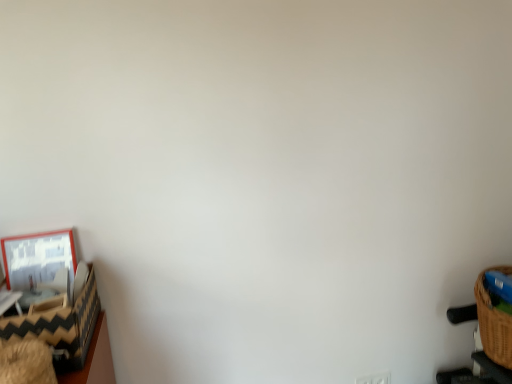
What do you see at coordinates (375, 378) in the screenshot? I see `white plastic electric outlet at lower right` at bounding box center [375, 378].

The image size is (512, 384). Identify the location of black and white zigzag-patterned basket at left. (61, 327).

Who is shorter, black and white zigzag-patterned basket at left or white plastic electric outlet at lower right?

With less height is white plastic electric outlet at lower right.

Is black and white zigzag-patterned basket at left wider than white plastic electric outlet at lower right?

Indeed, black and white zigzag-patterned basket at left has a greater width compared to white plastic electric outlet at lower right.

Is black and white zigzag-patterned basket at left spatially inside white plastic electric outlet at lower right, or outside of it?

black and white zigzag-patterned basket at left exists outside the volume of white plastic electric outlet at lower right.

Is matte wooden picture frame at left a part of black and white zigzag-patterned basket at left?

Definitely not — matte wooden picture frame at left is not inside black and white zigzag-patterned basket at left.

From the image's perspective, between black and white zigzag-patterned basket at left and matte wooden picture frame at left, who is located below?

black and white zigzag-patterned basket at left, from the image's perspective.

Based on the photo, could you tell me if black and white zigzag-patterned basket at left is turned towards matte wooden picture frame at left?

No, black and white zigzag-patterned basket at left is not aimed at matte wooden picture frame at left.

What's the angular difference between white plastic electric outlet at lower right and matte wooden picture frame at left's facing directions?

The angle between the facing direction of white plastic electric outlet at lower right and the facing direction of matte wooden picture frame at left is 1.95 degrees.

Is white plastic electric outlet at lower right at the right side of matte wooden picture frame at left?

Yes, white plastic electric outlet at lower right is to the right of matte wooden picture frame at left.

Which of these two, white plastic electric outlet at lower right or matte wooden picture frame at left, is thinner?

With smaller width is white plastic electric outlet at lower right.

Identify the location of picture frame to the left of white plastic electric outlet at lower right. (x=39, y=260).

Could black and white zigzag-patterned basket at left be considered to be inside matte wooden picture frame at left?

Definitely not — black and white zigzag-patterned basket at left is not inside matte wooden picture frame at left.

Can you confirm if matte wooden picture frame at left is positioned to the left of black and white zigzag-patterned basket at left?

Indeed, matte wooden picture frame at left is positioned on the left side of black and white zigzag-patterned basket at left.

From a real-world perspective, does matte wooden picture frame at left stand above black and white zigzag-patterned basket at left?

Indeed, from a real-world perspective, matte wooden picture frame at left stands above black and white zigzag-patterned basket at left.

Considering the sizes of objects matte wooden picture frame at left and black and white zigzag-patterned basket at left in the image provided, who is bigger, matte wooden picture frame at left or black and white zigzag-patterned basket at left?

With larger size is black and white zigzag-patterned basket at left.

From a real-world perspective, is matte wooden picture frame at left positioned under white plastic electric outlet at lower right based on gravity?

No, from a real-world perspective, matte wooden picture frame at left is not below white plastic electric outlet at lower right.

Is matte wooden picture frame at left thinner than white plastic electric outlet at lower right?

In fact, matte wooden picture frame at left might be wider than white plastic electric outlet at lower right.

From the image's perspective, is matte wooden picture frame at left below white plastic electric outlet at lower right?

No.

What are the coordinates of `picture frame above the white plastic electric outlet at lower right (from a real-world perspective)` in the screenshot? It's located at (39, 260).

Is white plastic electric outlet at lower right oriented towards black and white zigzag-patterned basket at left?

No, white plastic electric outlet at lower right is not facing towards black and white zigzag-patterned basket at left.

Considering the relative positions of white plastic electric outlet at lower right and black and white zigzag-patterned basket at left in the image provided, is white plastic electric outlet at lower right to the left of black and white zigzag-patterned basket at left from the viewer's perspective?

In fact, white plastic electric outlet at lower right is to the right of black and white zigzag-patterned basket at left.

How much distance is there between white plastic electric outlet at lower right and black and white zigzag-patterned basket at left?

white plastic electric outlet at lower right and black and white zigzag-patterned basket at left are 4.02 feet apart from each other.

You are a GUI agent. You are given a task and a screenshot of the screen. Output one action in this format:
    pyautogui.click(x=<x>, y=<y>)
    Task: Click on the basket located on the left of white plastic electric outlet at lower right
    
    Given the screenshot: What is the action you would take?
    pyautogui.click(x=61, y=327)

At what (x,y) coordinates should I click in order to perform the action: click on picture frame above the black and white zigzag-patterned basket at left (from the image's perspective). Please return your answer as a coordinate pair (x, y). Image resolution: width=512 pixels, height=384 pixels. Looking at the image, I should click on (39, 260).

Which object lies nearer to the anchor point black and white zigzag-patterned basket at left, white plastic electric outlet at lower right or matte wooden picture frame at left?

matte wooden picture frame at left is positioned closer to the anchor black and white zigzag-patterned basket at left.

Based on their spatial positions, is matte wooden picture frame at left or white plastic electric outlet at lower right closer to black and white zigzag-patterned basket at left?

Among the two, matte wooden picture frame at left is located nearer to black and white zigzag-patterned basket at left.

Looking at this image, based on their spatial positions, is black and white zigzag-patterned basket at left or white plastic electric outlet at lower right further from matte wooden picture frame at left?

Based on the image, white plastic electric outlet at lower right appears to be further to matte wooden picture frame at left.

Considering their positions, is black and white zigzag-patterned basket at left positioned further to white plastic electric outlet at lower right than matte wooden picture frame at left?

matte wooden picture frame at left is positioned further to the anchor white plastic electric outlet at lower right.

From the image, which object appears to be farther from matte wooden picture frame at left, white plastic electric outlet at lower right or black and white zigzag-patterned basket at left?

white plastic electric outlet at lower right is positioned further to the anchor matte wooden picture frame at left.

Which object lies further to the anchor point white plastic electric outlet at lower right, matte wooden picture frame at left or black and white zigzag-patterned basket at left?

matte wooden picture frame at left lies further to white plastic electric outlet at lower right than the other object.

Image resolution: width=512 pixels, height=384 pixels. Identify the location of basket between matte wooden picture frame at left and white plastic electric outlet at lower right in the horizontal direction. (61, 327).